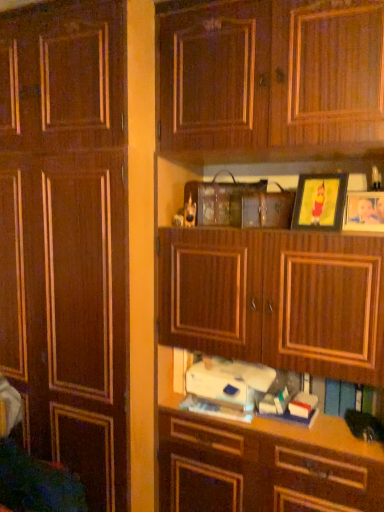
Question: From a real-world perspective, is white fabric swivel chair at lower left positioned over wooden photo frame at upper right, the 2th picture frame when ordered from left to right, based on gravity?

Choices:
 (A) yes
 (B) no

Answer: (B)

Question: Does white fabric swivel chair at lower left appear on the left side of wooden photo frame at upper right, the first picture frame when ordered from right to left?

Choices:
 (A) no
 (B) yes

Answer: (B)

Question: From the image's perspective, does white fabric swivel chair at lower left appear higher than wooden photo frame at upper right, the first picture frame when ordered from right to left?

Choices:
 (A) yes
 (B) no

Answer: (B)

Question: Is white fabric swivel chair at lower left surrounding wooden photo frame at upper right, the first picture frame when ordered from right to left?

Choices:
 (A) yes
 (B) no

Answer: (B)

Question: Can you confirm if white fabric swivel chair at lower left is smaller than wooden photo frame at upper right, the 2th picture frame when ordered from left to right?

Choices:
 (A) no
 (B) yes

Answer: (A)

Question: Is white fabric swivel chair at lower left located outside wooden photo frame at upper right, the first picture frame when ordered from right to left?

Choices:
 (A) no
 (B) yes

Answer: (B)

Question: Is the position of matte gold picture frame at upper right, placed as the first picture frame when sorted from left to right, more distant than that of wooden cabinet at center?

Choices:
 (A) no
 (B) yes

Answer: (B)

Question: Does matte gold picture frame at upper right, placed as the first picture frame when sorted from left to right, turn towards wooden cabinet at center?

Choices:
 (A) no
 (B) yes

Answer: (A)

Question: Is matte gold picture frame at upper right, which is the 2th picture frame in right-to-left order, in contact with wooden cabinet at center?

Choices:
 (A) yes
 (B) no

Answer: (B)

Question: Considering the relative sizes of matte gold picture frame at upper right, which is the 2th picture frame in right-to-left order, and wooden cabinet at center in the image provided, is matte gold picture frame at upper right, which is the 2th picture frame in right-to-left order, shorter than wooden cabinet at center?

Choices:
 (A) no
 (B) yes

Answer: (B)

Question: Considering the relative positions of matte gold picture frame at upper right, placed as the first picture frame when sorted from left to right, and wooden cabinet at center in the image provided, is matte gold picture frame at upper right, placed as the first picture frame when sorted from left to right, to the right of wooden cabinet at center from the viewer's perspective?

Choices:
 (A) yes
 (B) no

Answer: (A)

Question: Is matte gold picture frame at upper right, which is the 2th picture frame in right-to-left order, looking in the opposite direction of wooden cabinet at center?

Choices:
 (A) no
 (B) yes

Answer: (A)

Question: From a real-world perspective, is matte gold picture frame at upper right, placed as the first picture frame when sorted from left to right, on top of white matte book at center?

Choices:
 (A) no
 (B) yes

Answer: (B)